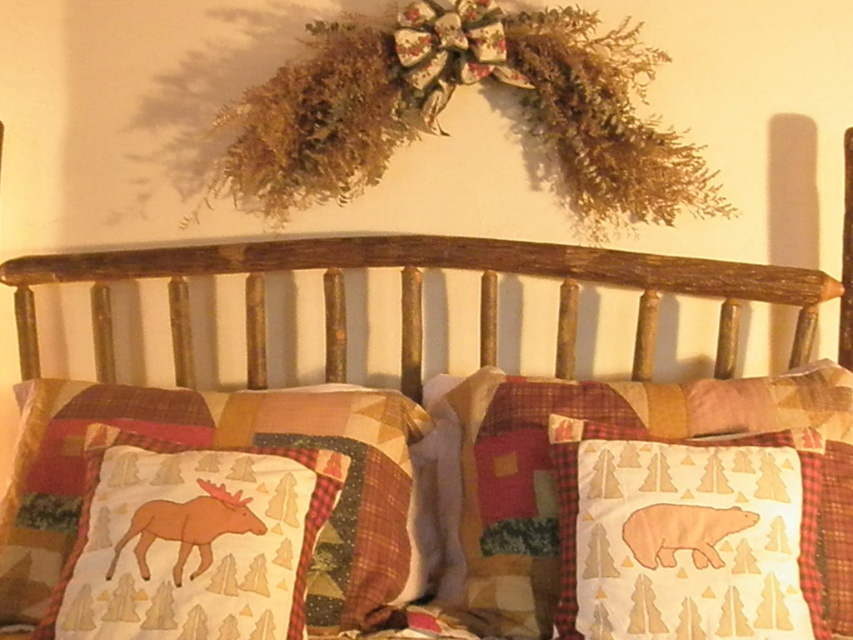
Question: Which of the following is the closest to the observer?

Choices:
 (A) rustic wood headboard at center
 (B) beige fabric bear at center

Answer: (B)

Question: Which object is the closest to the rustic wood headboard at center?

Choices:
 (A) brown fabric moose at lower left
 (B) beige fabric bear at center
 (C) white cotton bear at center
 (D) patchwork fabric pillow with moose design at center

Answer: (C)

Question: Considering the relative positions of white cotton bear at center and brown fabric moose at lower left in the image provided, where is white cotton bear at center located with respect to brown fabric moose at lower left?

Choices:
 (A) above
 (B) below

Answer: (A)

Question: Which point is closer to the camera taking this photo?

Choices:
 (A) (212, 522)
 (B) (50, 536)
 (C) (714, 563)
 (D) (836, 605)

Answer: (C)

Question: Can you confirm if white cotton bear at center is positioned to the right of brown fabric moose at lower left?

Choices:
 (A) no
 (B) yes

Answer: (B)

Question: Considering the relative positions of rustic wood headboard at center and white cotton bear at center in the image provided, where is rustic wood headboard at center located with respect to white cotton bear at center?

Choices:
 (A) right
 (B) left

Answer: (B)